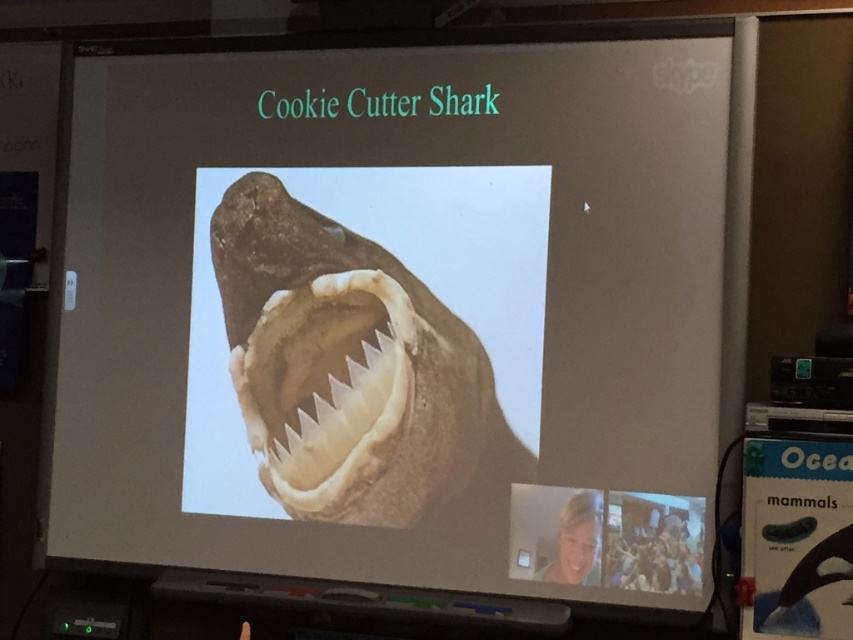
Question: Is brown rough cookie cutter shark at center to the right of white glossy teeth at center from the viewer's perspective?

Choices:
 (A) yes
 (B) no

Answer: (A)

Question: Which point is farther to the camera?

Choices:
 (A) (299, 397)
 (B) (328, 445)

Answer: (A)

Question: Which of the following is the closest to the observer?

Choices:
 (A) white glossy teeth at center
 (B) brown rough cookie cutter shark at center

Answer: (B)

Question: Is brown rough cookie cutter shark at center below white glossy teeth at center?

Choices:
 (A) no
 (B) yes

Answer: (B)

Question: Can you confirm if brown rough cookie cutter shark at center is smaller than white glossy teeth at center?

Choices:
 (A) yes
 (B) no

Answer: (B)